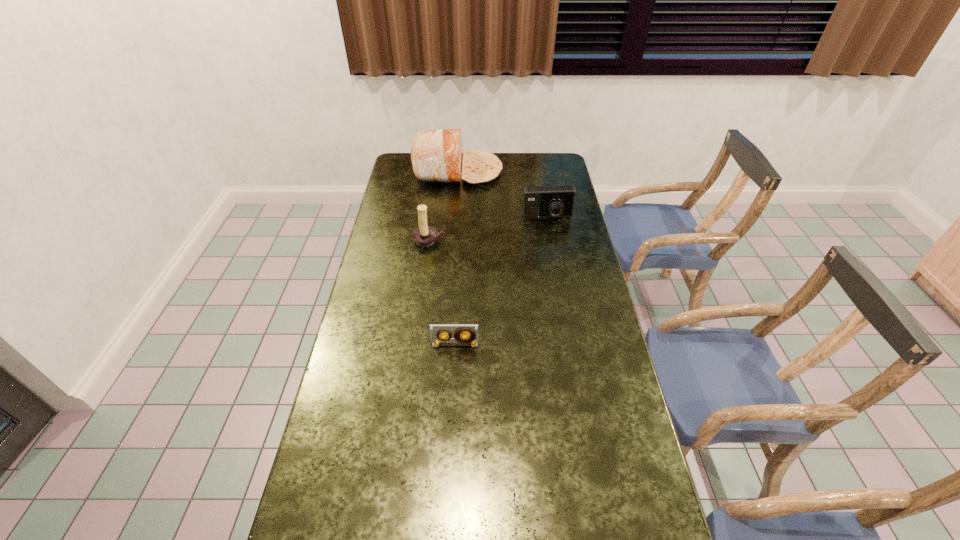
I want to click on bread, so click(x=436, y=155).

I want to click on the second nearest object, so click(x=424, y=236).

Identify the location of camera. Image resolution: width=960 pixels, height=540 pixels. (539, 202).

The height and width of the screenshot is (540, 960). What are the coordinates of `the rightmost object` in the screenshot? It's located at (539, 202).

The height and width of the screenshot is (540, 960). I want to click on videotape, so tap(437, 331).

Where is `the shortest object`? the shortest object is located at coordinates (437, 331).

Locate an element on the screen. This screenshot has width=960, height=540. vacant space situated at the sliced end of the bread is located at coordinates pyautogui.click(x=537, y=171).

This screenshot has width=960, height=540. What are the coordinates of `blank space located on the wick of the candle holder` in the screenshot? It's located at (418, 329).

Locate an element on the screen. The height and width of the screenshot is (540, 960). free region located 0.320m on the front-facing side of the third tallest object is located at coordinates (559, 281).

You are a GUI agent. You are given a task and a screenshot of the screen. Output one action in this format:
    pyautogui.click(x=<x>, y=<y>)
    Task: Click on the free region located 0.290m at the front of the shortest object with visible reels
    This screenshot has width=960, height=540.
    Given the screenshot: What is the action you would take?
    pyautogui.click(x=450, y=440)